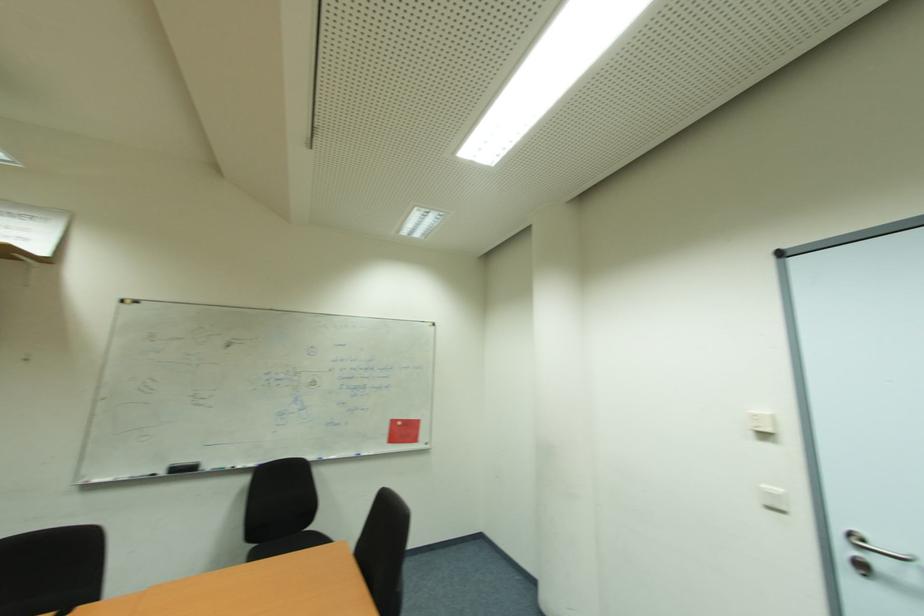
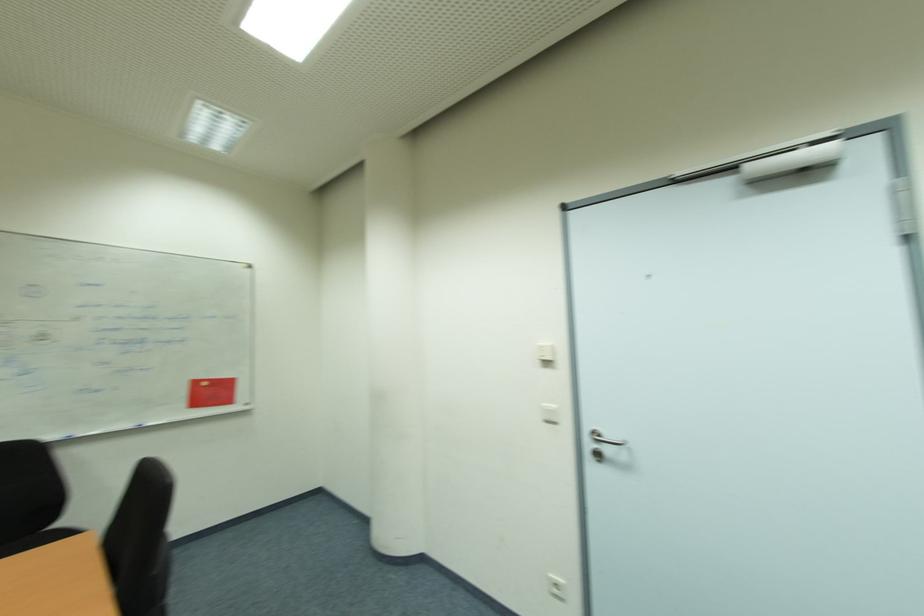
Question: I am providing you with two images of the same scene from different viewpoints. After the viewpoint changes to image2, which objects are now occluded?

Choices:
 (A) white power outlet
 (B) metal door handle
 (C) white light switch
 (D) none of these

Answer: (D)